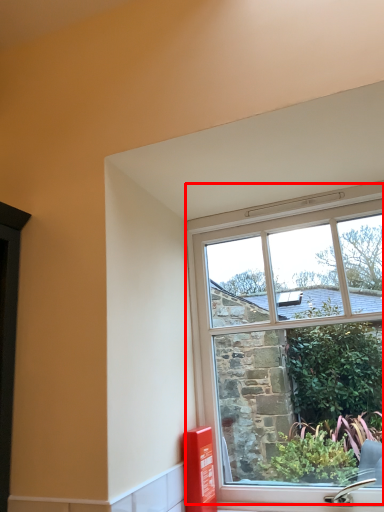
Question: From the image's perspective, what is the correct spatial relationship of window (annotated by the red box) in relation to window box?

Choices:
 (A) below
 (B) above

Answer: (B)